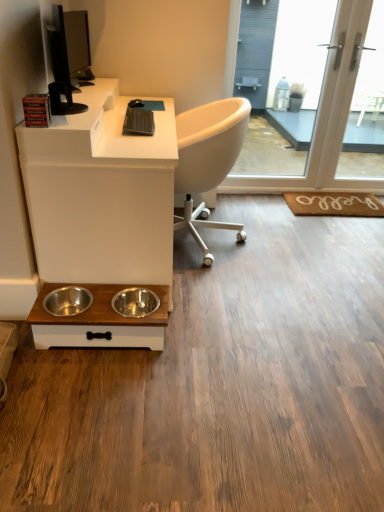
Locate an element on the screen. transparent glass screen door at upper right, which ranks as the 2th screen door in right-to-left order is located at coordinates (280, 78).

The image size is (384, 512). What do you see at coordinates (99, 322) in the screenshot?
I see `stainless steel bowls at lower center` at bounding box center [99, 322].

What are the coordinates of `white matte desk at lower left` in the screenshot? It's located at (101, 193).

I want to click on computer monitor that is above the brown woven mat at lower right (from the image's perspective), so click(67, 56).

From the image's perspective, between brown woven mat at lower right and black glossy monitor at upper left, who is located below?

From the image's view, brown woven mat at lower right is below.

Considering the relative sizes of brown woven mat at lower right and black glossy monitor at upper left in the image provided, is brown woven mat at lower right smaller than black glossy monitor at upper left?

Indeed, brown woven mat at lower right has a smaller size compared to black glossy monitor at upper left.

Is white matte desk at lower left oriented towards transparent glass screen door at upper right, positioned as the first screen door in left-to-right order?

Yes, white matte desk at lower left is oriented towards transparent glass screen door at upper right, positioned as the first screen door in left-to-right order.

Could you measure the distance between white matte desk at lower left and transparent glass screen door at upper right, which ranks as the 2th screen door in right-to-left order?

They are 9.97 feet apart.

Consider the image. From the image's perspective, is white matte desk at lower left above or below transparent glass screen door at upper right, positioned as the first screen door in left-to-right order?

white matte desk at lower left is below transparent glass screen door at upper right, positioned as the first screen door in left-to-right order.

Would you say white matte desk at lower left is outside transparent glass screen door at upper right, which ranks as the 2th screen door in right-to-left order?

Yes, white matte desk at lower left is located beyond the bounds of transparent glass screen door at upper right, which ranks as the 2th screen door in right-to-left order.

Considering the sizes of objects black glossy monitor at upper left and white matte desk at lower left in the image provided, who is smaller, black glossy monitor at upper left or white matte desk at lower left?

With smaller size is black glossy monitor at upper left.

From the image's perspective, which is above, black glossy monitor at upper left or white matte desk at lower left?

black glossy monitor at upper left appears higher in the image.

Is black glossy monitor at upper left situated inside white matte desk at lower left or outside?

black glossy monitor at upper left is located beyond the bounds of white matte desk at lower left.

From a real-world perspective, is black glossy monitor at upper left located beneath white matte desk at lower left?

No, from a real-world perspective, black glossy monitor at upper left is not under white matte desk at lower left.

Is transparent glass screen door at upper right, positioned as the first screen door in left-to-right order, placed right next to white glass screen door at upper right, which ranks as the second screen door in left-to-right order?

No, transparent glass screen door at upper right, positioned as the first screen door in left-to-right order, is not touching white glass screen door at upper right, which ranks as the second screen door in left-to-right order.

Who is taller, transparent glass screen door at upper right, positioned as the first screen door in left-to-right order, or white glass screen door at upper right, which ranks as the second screen door in left-to-right order?

With more height is white glass screen door at upper right, which ranks as the second screen door in left-to-right order.

Is the depth of transparent glass screen door at upper right, which ranks as the 2th screen door in right-to-left order, less than that of white glass screen door at upper right, which ranks as the second screen door in left-to-right order?

Yes, the depth of transparent glass screen door at upper right, which ranks as the 2th screen door in right-to-left order, is less than that of white glass screen door at upper right, which ranks as the second screen door in left-to-right order.

Considering the relative sizes of transparent glass screen door at upper right, positioned as the first screen door in left-to-right order, and black glossy monitor at upper left in the image provided, is transparent glass screen door at upper right, positioned as the first screen door in left-to-right order, taller than black glossy monitor at upper left?

Yes.

How many degrees apart are the facing directions of transparent glass screen door at upper right, which ranks as the 2th screen door in right-to-left order, and black glossy monitor at upper left?

There is a 78.1-degree angle between the facing directions of transparent glass screen door at upper right, which ranks as the 2th screen door in right-to-left order, and black glossy monitor at upper left.

Which object is closer to the camera taking this photo, transparent glass screen door at upper right, which ranks as the 2th screen door in right-to-left order, or black glossy monitor at upper left?

black glossy monitor at upper left.

Is point (265, 113) positioned behind point (70, 70)?

Yes, it is.

Is black glossy monitor at upper left oriented towards transparent glass screen door at upper right, positioned as the first screen door in left-to-right order?

No, black glossy monitor at upper left does not turn towards transparent glass screen door at upper right, positioned as the first screen door in left-to-right order.

Which object is more forward, black glossy monitor at upper left or transparent glass screen door at upper right, positioned as the first screen door in left-to-right order?

black glossy monitor at upper left is in front.

How distant is black glossy monitor at upper left from transparent glass screen door at upper right, positioned as the first screen door in left-to-right order?

black glossy monitor at upper left is 3.44 meters from transparent glass screen door at upper right, positioned as the first screen door in left-to-right order.

From the image's perspective, is black glossy monitor at upper left on transparent glass screen door at upper right, which ranks as the 2th screen door in right-to-left order?

No, from the image's perspective, black glossy monitor at upper left is not above transparent glass screen door at upper right, which ranks as the 2th screen door in right-to-left order.

Is transparent glass screen door at upper right, positioned as the first screen door in left-to-right order, surrounded by brown woven mat at lower right?

That's incorrect, transparent glass screen door at upper right, positioned as the first screen door in left-to-right order, is not inside brown woven mat at lower right.

Is brown woven mat at lower right bigger or smaller than transparent glass screen door at upper right, which ranks as the 2th screen door in right-to-left order?

brown woven mat at lower right is smaller than transparent glass screen door at upper right, which ranks as the 2th screen door in right-to-left order.

Which of these two, brown woven mat at lower right or transparent glass screen door at upper right, which ranks as the 2th screen door in right-to-left order, stands shorter?

brown woven mat at lower right.

From a real-world perspective, which object stands above the other?

transparent glass screen door at upper right, positioned as the first screen door in left-to-right order, is physically above.

You are a GUI agent. You are given a task and a screenshot of the screen. Output one action in this format:
    pyautogui.click(x=<x>, y=<y>)
    Task: Click on the computer monitor in front of the brown woven mat at lower right
    The image size is (384, 512).
    Given the screenshot: What is the action you would take?
    pyautogui.click(x=67, y=56)

Where is `desk below the transparent glass screen door at upper right, which ranks as the 2th screen door in right-to-left order (from a real-world perspective)`? Image resolution: width=384 pixels, height=512 pixels. desk below the transparent glass screen door at upper right, which ranks as the 2th screen door in right-to-left order (from a real-world perspective) is located at coordinates (101, 193).

Estimate the real-world distances between objects in this image. Which object is closer to brown woven mat at lower right, stainless steel bowls at lower center or black glossy monitor at upper left?

stainless steel bowls at lower center is closer to brown woven mat at lower right.

Based on their spatial positions, is black glossy monitor at upper left or transparent glass screen door at upper right, which ranks as the 2th screen door in right-to-left order, further from white matte desk at lower left?

transparent glass screen door at upper right, which ranks as the 2th screen door in right-to-left order, is positioned further to the anchor white matte desk at lower left.

Looking at the image, which one is located closer to transparent glass screen door at upper right, positioned as the first screen door in left-to-right order, white matte desk at lower left or black glossy monitor at upper left?

white matte desk at lower left.

Looking at the image, which one is located closer to black glossy monitor at upper left, white matte desk at lower left or transparent glass screen door at upper right, which ranks as the 2th screen door in right-to-left order?

white matte desk at lower left.

When comparing their distances from black glossy monitor at upper left, does white glass screen door at upper right, the first screen door from the right, or brown woven mat at lower right seem further?

Based on the image, white glass screen door at upper right, the first screen door from the right, appears to be further to black glossy monitor at upper left.

From the image, which object appears to be farther from transparent glass screen door at upper right, positioned as the first screen door in left-to-right order, white matte desk at lower left or white glass screen door at upper right, which ranks as the second screen door in left-to-right order?

The object further to transparent glass screen door at upper right, positioned as the first screen door in left-to-right order, is white matte desk at lower left.

Which object lies further to the anchor point brown woven mat at lower right, transparent glass screen door at upper right, positioned as the first screen door in left-to-right order, or stainless steel bowls at lower center?

Among the two, transparent glass screen door at upper right, positioned as the first screen door in left-to-right order, is located further to brown woven mat at lower right.

When comparing their distances from white glass screen door at upper right, which ranks as the second screen door in left-to-right order, does stainless steel bowls at lower center or black glossy monitor at upper left seem closer?

black glossy monitor at upper left.

Where is `desk located between black glossy monitor at upper left and brown woven mat at lower right in the left-right direction`? The image size is (384, 512). desk located between black glossy monitor at upper left and brown woven mat at lower right in the left-right direction is located at coordinates (101, 193).

Identify the location of screen door located between black glossy monitor at upper left and white glass screen door at upper right, which ranks as the second screen door in left-to-right order, in the left-right direction. The image size is (384, 512). (280, 78).

Where is `table between white matte desk at lower left and brown woven mat at lower right from left to right`? Image resolution: width=384 pixels, height=512 pixels. table between white matte desk at lower left and brown woven mat at lower right from left to right is located at coordinates (99, 322).

Find the location of a particular element. This screenshot has height=512, width=384. screen door between black glossy monitor at upper left and brown woven mat at lower right in the horizontal direction is located at coordinates (280, 78).